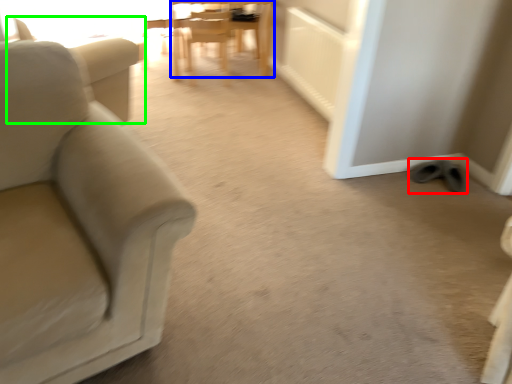
Question: Which object is positioned farthest from footwear (highlighted by a red box)? Select from chair (highlighted by a blue box) and swivel chair (highlighted by a green box).

Choices:
 (A) chair
 (B) swivel chair

Answer: (A)